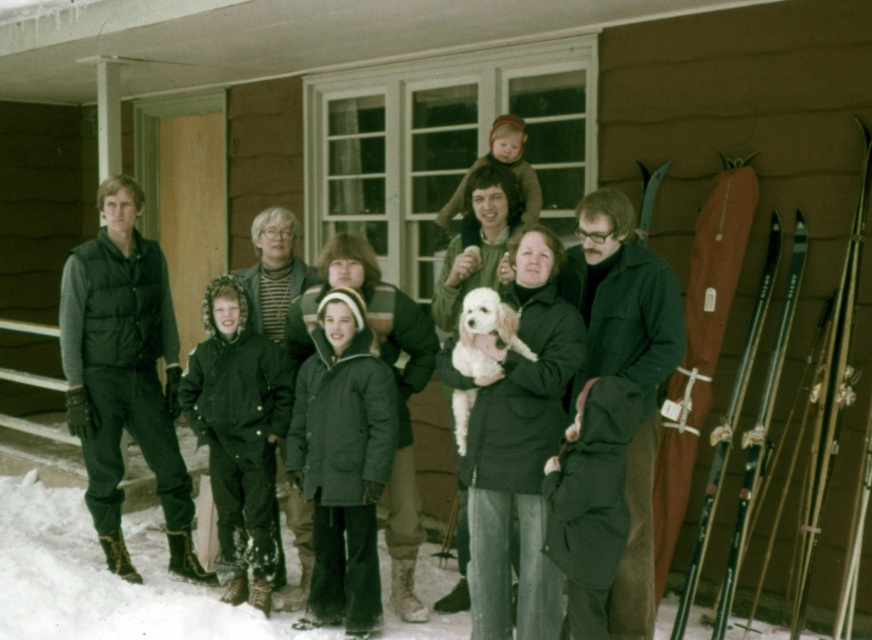
Question: Which of the following is the farthest from the observer?

Choices:
 (A) (104, 355)
 (B) (208, 305)
 (C) (734, 378)

Answer: (A)

Question: Which point is closer to the camera?

Choices:
 (A) dark green puffy coat at center
 (B) dark gray parka at center

Answer: (B)

Question: Is dark gray parka at center positioned before dark gray puffy jackets at center?

Choices:
 (A) yes
 (B) no

Answer: (B)

Question: Does dark green puffy vest at left have a smaller size compared to dark gray parka at center?

Choices:
 (A) yes
 (B) no

Answer: (B)

Question: Can you confirm if wooden ski at right is positioned to the left of wooden skis at right?

Choices:
 (A) yes
 (B) no

Answer: (B)

Question: Which object is farther from the camera taking this photo?

Choices:
 (A) dark gray puffy jackets at center
 (B) white fluffy dog at center
 (C) dark green puffy vest at left

Answer: (C)